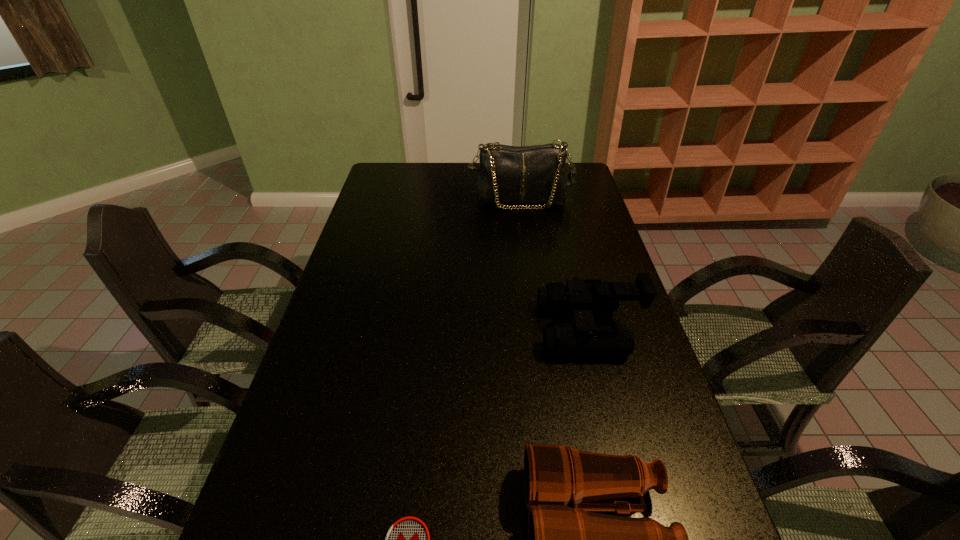
Locate an element on the screen. This screenshot has width=960, height=540. binoculars situated at the right edge is located at coordinates (580, 297).

Locate an element on the screen. object that is at the far right corner is located at coordinates (535, 174).

Identify the location of vacant space at the far edge of the desktop. The width and height of the screenshot is (960, 540). (440, 187).

Locate an element on the screen. This screenshot has width=960, height=540. blank area at the left edge is located at coordinates (385, 251).

The image size is (960, 540). Identify the location of vacant space at the right edge. (645, 451).

Where is `free space at the far left corner`? This screenshot has height=540, width=960. free space at the far left corner is located at coordinates (389, 168).

Where is `free space between the handbag and the taller binoculars`? This screenshot has height=540, width=960. free space between the handbag and the taller binoculars is located at coordinates (555, 265).

Identify which object is located as the second nearest to the nearer binoculars. Please provide its 2D coordinates. Your answer should be formatted as a tuple, i.e. [(x, y)], where the tuple contains the x and y coordinates of a point satisfying the conditions above.

[(580, 297)]

Select which object appears as the third closest to the farthest object. Please provide its 2D coordinates. Your answer should be formatted as a tuple, i.e. [(x, y)], where the tuple contains the x and y coordinates of a point satisfying the conditions above.

[(408, 539)]